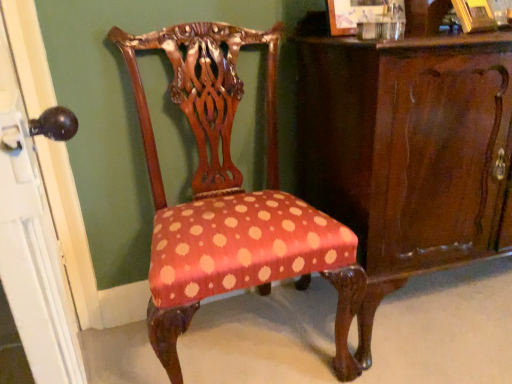
This screenshot has height=384, width=512. What do you see at coordinates (230, 198) in the screenshot?
I see `polka dot fabric chair at center` at bounding box center [230, 198].

Identify the location of polka dot fabric chair at center. (230, 198).

In the scene shown: In order to face matte black knob at left, should I rotate leftwards or rightwards?

You should rotate left by 27.572 degrees.

Find the location of a particular element. The image size is (512, 384). polka dot fabric chair at center is located at coordinates (230, 198).

Does shiny dark wood vanity at center appear on the left side of polka dot fabric chair at center?

In fact, shiny dark wood vanity at center is to the right of polka dot fabric chair at center.

Considering the relative sizes of shiny dark wood vanity at center and polka dot fabric chair at center in the image provided, is shiny dark wood vanity at center bigger than polka dot fabric chair at center?

Yes, shiny dark wood vanity at center is bigger than polka dot fabric chair at center.

From a real-world perspective, is shiny dark wood vanity at center on polka dot fabric chair at center?

No.

What's the angular difference between shiny dark wood vanity at center and polka dot fabric chair at center's facing directions?

There is a 0.000574-degree angle between the facing directions of shiny dark wood vanity at center and polka dot fabric chair at center.

From the picture: From a real-world perspective, relative to matte black knob at left, is polka dot fabric chair at center vertically above or below?

In terms of real-world spatial position, polka dot fabric chair at center is below matte black knob at left.

Can you confirm if polka dot fabric chair at center is taller than matte black knob at left?

In fact, polka dot fabric chair at center may be shorter than matte black knob at left.

Is polka dot fabric chair at center oriented away from matte black knob at left?

Answer: polka dot fabric chair at center does not have its back to matte black knob at left.

How far apart are polka dot fabric chair at center and matte black knob at left?

The distance of polka dot fabric chair at center from matte black knob at left is 18.34 inches.

Would you say matte black knob at left is outside polka dot fabric chair at center?

Yes, matte black knob at left is not within polka dot fabric chair at center.

From a real-world perspective, is matte black knob at left above or below polka dot fabric chair at center?

Clearly, from a real-world perspective, matte black knob at left is above polka dot fabric chair at center.

Based on the photo, is matte black knob at left far from polka dot fabric chair at center?

That's not correct — matte black knob at left is a little close to polka dot fabric chair at center.

Considering the relative sizes of matte black knob at left and polka dot fabric chair at center in the image provided, is matte black knob at left smaller than polka dot fabric chair at center?

Yes, matte black knob at left is smaller than polka dot fabric chair at center.

Is matte black knob at left situated inside shiny dark wood vanity at center or outside?

matte black knob at left cannot be found inside shiny dark wood vanity at center.

Between point (39, 179) and point (385, 280), which one is positioned behind?

Point (385, 280)

From the image's perspective, between matte black knob at left and shiny dark wood vanity at center, which one is located above?

A: shiny dark wood vanity at center appears higher in the image.

Is matte black knob at left next to shiny dark wood vanity at center?

matte black knob at left is not next to shiny dark wood vanity at center, and they're not touching.

From the picture: Would you consider shiny dark wood vanity at center to be distant from matte black knob at left?

They are positioned close to each other.

Does shiny dark wood vanity at center have a lesser height compared to matte black knob at left?

Yes, shiny dark wood vanity at center is shorter than matte black knob at left.

In terms of width, does shiny dark wood vanity at center look wider or thinner when compared to matte black knob at left?

Considering their sizes, shiny dark wood vanity at center looks broader than matte black knob at left.

Image resolution: width=512 pixels, height=384 pixels. What are the coordinates of `vanity below the matte black knob at left (from a real-world perspective)` in the screenshot? It's located at (407, 150).

Looking at this image, considering the relative sizes of polka dot fabric chair at center and shiny dark wood vanity at center in the image provided, is polka dot fabric chair at center taller than shiny dark wood vanity at center?

Indeed, polka dot fabric chair at center has a greater height compared to shiny dark wood vanity at center.

Is polka dot fabric chair at center positioned far away from shiny dark wood vanity at center?

No.

Is polka dot fabric chair at center positioned with its back to shiny dark wood vanity at center?

polka dot fabric chair at center does not have its back to shiny dark wood vanity at center.

Locate an element on the screen. vanity above the polka dot fabric chair at center (from the image's perspective) is located at coordinates (407, 150).

The image size is (512, 384). Identify the location of vanity behind the polka dot fabric chair at center. (407, 150).

The height and width of the screenshot is (384, 512). Identify the location of screen door located below the polka dot fabric chair at center (from the image's perspective). (32, 244).

From the image, which object appears to be farther from polka dot fabric chair at center, matte black knob at left or shiny dark wood vanity at center?

matte black knob at left.

Estimate the real-world distances between objects in this image. Which object is further from matte black knob at left, polka dot fabric chair at center or shiny dark wood vanity at center?

Based on the image, shiny dark wood vanity at center appears to be further to matte black knob at left.

Based on their spatial positions, is polka dot fabric chair at center or matte black knob at left further from shiny dark wood vanity at center?

matte black knob at left is further to shiny dark wood vanity at center.

When comparing their distances from polka dot fabric chair at center, does shiny dark wood vanity at center or matte black knob at left seem further?

The object further to polka dot fabric chair at center is matte black knob at left.

Considering their positions, is matte black knob at left positioned further to shiny dark wood vanity at center than polka dot fabric chair at center?

matte black knob at left is positioned further to the anchor shiny dark wood vanity at center.

Based on the photo, when comparing their distances from matte black knob at left, does shiny dark wood vanity at center or polka dot fabric chair at center seem closer?

Based on the image, polka dot fabric chair at center appears to be nearer to matte black knob at left.

Identify the location of chair located between matte black knob at left and shiny dark wood vanity at center in the left-right direction. The width and height of the screenshot is (512, 384). (230, 198).